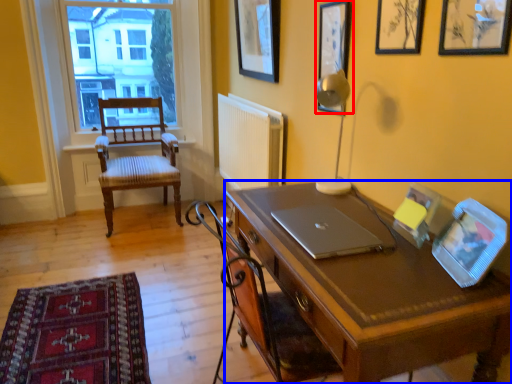
Question: Which object appears farthest to the camera in this image, picture frame (highlighted by a red box) or desk (highlighted by a blue box)?

Choices:
 (A) picture frame
 (B) desk

Answer: (A)